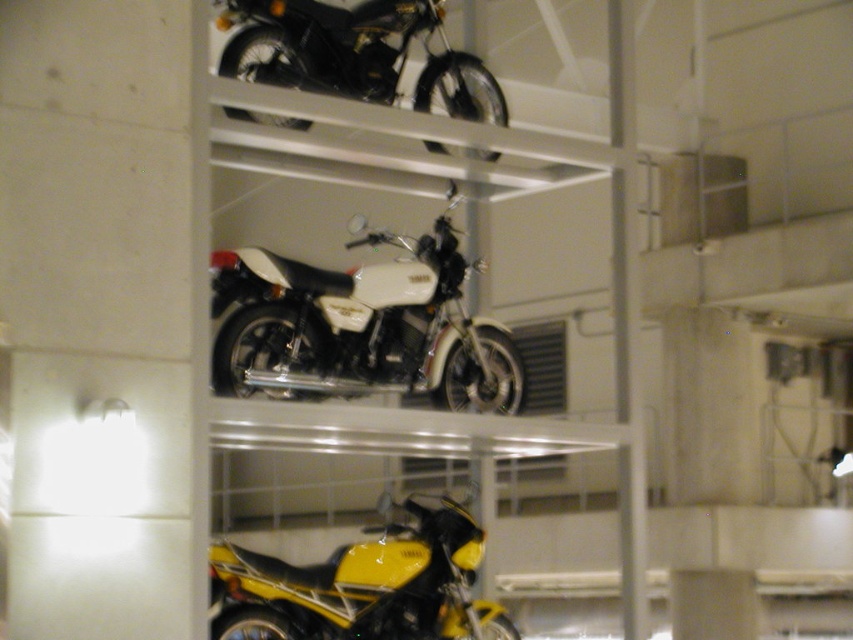
You are a mechanic who needs to move the yellow glossy motorcycle at lower center and the shiny black motorcycle at upper center from their current positions. Based on their sizes, which motorcycle will require more space when being transported?

The yellow glossy motorcycle at lower center requires more space when being transported because it is bigger than the shiny black motorcycle at upper center according to the description.

You are a mechanic who needs to move the motorcycles for maintenance. Since the shiny black motorcycle at upper center is lighter than the white matte motorcycle at center, which one should you move first to minimize effort?

The shiny black motorcycle at upper center should be moved first because it is lighter than the white matte motorcycle at center, requiring less effort.

You are a mechanic who needs to access the white matte motorcycle at center. Since it is stored under the shiny black motorcycle at upper center, can you reach it without moving the motorcycle above it?

The white matte motorcycle at center is positioned under the shiny black motorcycle at upper center, so you cannot reach it without moving the motorcycle above it.